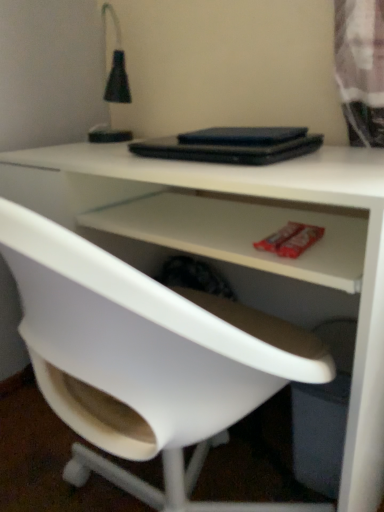
Question: From the image's perspective, does white plastic chair at center appear higher than black matte table lamp at upper left?

Choices:
 (A) yes
 (B) no

Answer: (B)

Question: Is white plastic chair at center at the left side of black matte table lamp at upper left?

Choices:
 (A) no
 (B) yes

Answer: (A)

Question: Is white plastic chair at center bigger than black matte table lamp at upper left?

Choices:
 (A) yes
 (B) no

Answer: (A)

Question: Is white plastic chair at center wider than black matte table lamp at upper left?

Choices:
 (A) no
 (B) yes

Answer: (B)

Question: From a real-world perspective, is white plastic chair at center beneath black matte table lamp at upper left?

Choices:
 (A) no
 (B) yes

Answer: (B)

Question: Does white plastic chair at center have a smaller size compared to black matte table lamp at upper left?

Choices:
 (A) yes
 (B) no

Answer: (B)

Question: Is black matte table lamp at upper left bigger than black matte laptop at center?

Choices:
 (A) no
 (B) yes

Answer: (B)

Question: Is black matte table lamp at upper left shorter than black matte laptop at center?

Choices:
 (A) no
 (B) yes

Answer: (A)

Question: Considering the relative sizes of black matte table lamp at upper left and black matte laptop at center in the image provided, is black matte table lamp at upper left taller than black matte laptop at center?

Choices:
 (A) yes
 (B) no

Answer: (A)

Question: From the image's perspective, is black matte table lamp at upper left under black matte laptop at center?

Choices:
 (A) no
 (B) yes

Answer: (A)

Question: Considering the relative sizes of black matte table lamp at upper left and black matte laptop at center in the image provided, is black matte table lamp at upper left wider than black matte laptop at center?

Choices:
 (A) no
 (B) yes

Answer: (A)

Question: Would you say black matte laptop at center is part of black matte table lamp at upper left's contents?

Choices:
 (A) yes
 (B) no

Answer: (B)

Question: Are black matte laptop at center and white plastic chair at center far apart?

Choices:
 (A) yes
 (B) no

Answer: (B)